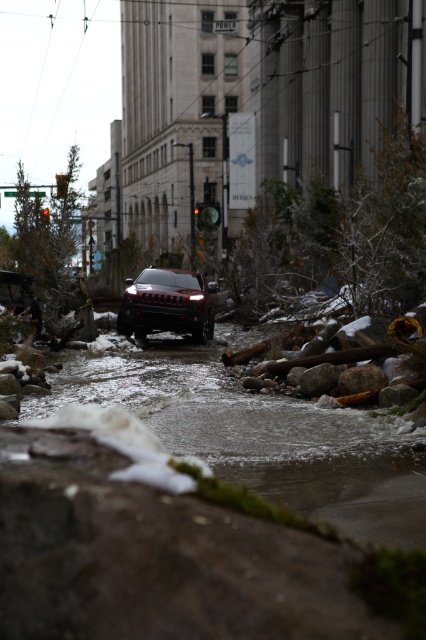
Question: From the image, what is the correct spatial relationship of clear ice water at center in relation to shiny black suv at center?

Choices:
 (A) right
 (B) left

Answer: (A)

Question: Which object is closer to the camera taking this photo?

Choices:
 (A) clear ice water at center
 (B) shiny black suv at center

Answer: (A)

Question: Is clear ice water at center to the right of shiny black suv at center from the viewer's perspective?

Choices:
 (A) no
 (B) yes

Answer: (B)

Question: Can you confirm if clear ice water at center is positioned above shiny black suv at center?

Choices:
 (A) no
 (B) yes

Answer: (A)

Question: Which of the following is the farthest from the observer?

Choices:
 (A) shiny black suv at center
 (B) clear ice water at center

Answer: (A)